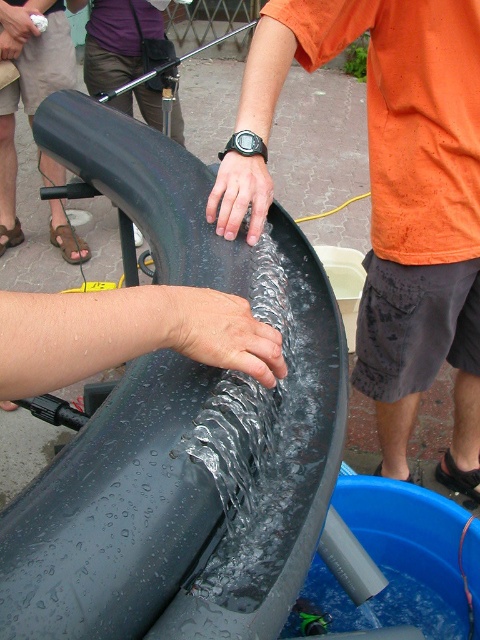
Question: Which is nearer to the wet skin at center?

Choices:
 (A) matte black hand at center
 (B) orange fabric shirt at center
 (C) glossy metallic hand at center

Answer: (C)

Question: In this image, where is orange fabric shirt at center located relative to matte black hand at center?

Choices:
 (A) right
 (B) left

Answer: (A)

Question: Which of the following is the closest to the observer?

Choices:
 (A) matte black hand at center
 (B) glossy metallic hand at center

Answer: (B)

Question: Is glossy metallic hand at center positioned before matte black hand at center?

Choices:
 (A) yes
 (B) no

Answer: (A)

Question: Is orange fabric shirt at center to the right of matte black hand at center from the viewer's perspective?

Choices:
 (A) no
 (B) yes

Answer: (B)

Question: Which point is closer to the camera?

Choices:
 (A) (389, 465)
 (B) (164, 314)

Answer: (B)